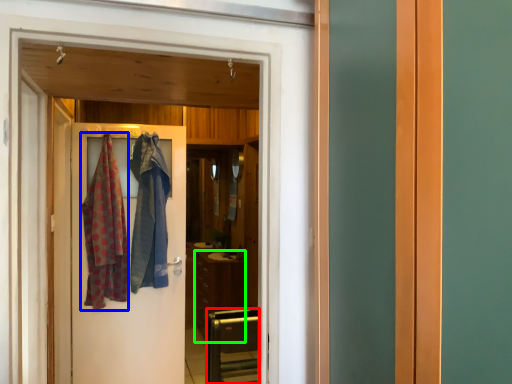
Question: Which object is the farthest from furniture (highlighted by a red box)? Choose among these: clothing (highlighted by a blue box) or cabinetry (highlighted by a green box).

Choices:
 (A) clothing
 (B) cabinetry

Answer: (B)